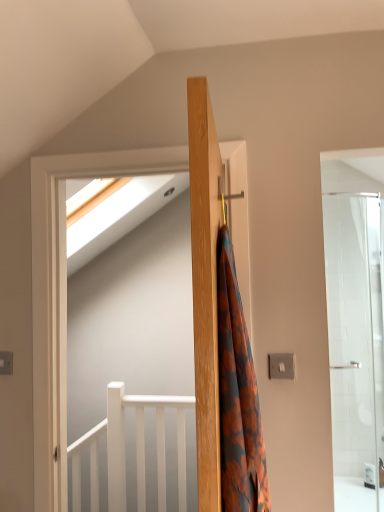
What do you see at coordinates (125, 452) in the screenshot? This screenshot has height=512, width=384. I see `white matte balustrade at lower left` at bounding box center [125, 452].

Describe the element at coordinates (220, 337) in the screenshot. I see `wooden coat hanger at center` at that location.

Image resolution: width=384 pixels, height=512 pixels. Find the location of `white glossy screen door at upper left`. white glossy screen door at upper left is located at coordinates (138, 357).

Image resolution: width=384 pixels, height=512 pixels. I want to click on orange floral fabric at center, so click(238, 396).

Does point (167, 401) come farther from viewer compared to point (211, 364)?

Yes, it is.

Between white glossy screen door at upper left and wooden coat hanger at center, which one appears on the right side from the viewer's perspective?

From the viewer's perspective, wooden coat hanger at center appears more on the right side.

Is there a large distance between white glossy screen door at upper left and wooden coat hanger at center?

That's right, there is a large distance between white glossy screen door at upper left and wooden coat hanger at center.

In the scene shown: Does white glossy screen door at upper left lie in front of wooden coat hanger at center?

That is False.

From a real-world perspective, does white matte balustrade at lower left sit lower than orange floral fabric at center?

Yes.

Considering the positions of objects white matte balustrade at lower left and orange floral fabric at center in the image provided, who is behind, white matte balustrade at lower left or orange floral fabric at center?

white matte balustrade at lower left is further from the camera.

Is white matte balustrade at lower left in contact with orange floral fabric at center?

No, white matte balustrade at lower left is not in contact with orange floral fabric at center.

Does point (117, 391) appear closer or farther from the camera than point (220, 340)?

Point (117, 391) appears to be farther away from the viewer than point (220, 340).

Is point (79, 461) behind point (116, 389)?

That is True.

Which is more to the left, white glossy screen door at upper left or white matte balustrade at lower left?

Positioned to the left is white matte balustrade at lower left.

Could you tell me if white glossy screen door at upper left is facing white matte balustrade at lower left?

No, white glossy screen door at upper left is not facing towards white matte balustrade at lower left.

From the picture: Which of these two, white matte balustrade at lower left or wooden coat hanger at center, is bigger?

With larger size is white matte balustrade at lower left.

Which object is wider, white matte balustrade at lower left or wooden coat hanger at center?

white matte balustrade at lower left is wider.

From the image's perspective, is white matte balustrade at lower left positioned above or below wooden coat hanger at center?

white matte balustrade at lower left is below wooden coat hanger at center.

How much distance is there between white matte balustrade at lower left and wooden coat hanger at center?

A distance of 1.77 meters exists between white matte balustrade at lower left and wooden coat hanger at center.

Are orange floral fabric at center and wooden coat hanger at center far apart?

orange floral fabric at center is actually quite close to wooden coat hanger at center.

How different are the orientations of orange floral fabric at center and wooden coat hanger at center in degrees?

There is a 177-degree angle between the facing directions of orange floral fabric at center and wooden coat hanger at center.

From a real-world perspective, who is located lower, orange floral fabric at center or wooden coat hanger at center?

In real-world perspective, orange floral fabric at center is lower.

Is wooden coat hanger at center at the back of orange floral fabric at center?

Yes, orange floral fabric at center's orientation is away from wooden coat hanger at center.

Which is closer, [212,344] or [222,391]?

The point [212,344] is closer.

Based on their sizes in the image, would you say wooden coat hanger at center is bigger or smaller than orange floral fabric at center?

wooden coat hanger at center is bigger than orange floral fabric at center.

Which object is further away from the camera, wooden coat hanger at center or orange floral fabric at center?

orange floral fabric at center is further from the camera.

Which of these two, wooden coat hanger at center or orange floral fabric at center, is wider?

Wider between the two is wooden coat hanger at center.

Is wooden coat hanger at center taller than white glossy screen door at upper left?

In fact, wooden coat hanger at center may be shorter than white glossy screen door at upper left.

From the image's perspective, is wooden coat hanger at center above or below white glossy screen door at upper left?

Clearly, from the image's perspective, wooden coat hanger at center is above white glossy screen door at upper left.

Find the location of a particular element. The width and height of the screenshot is (384, 512). door above the white glossy screen door at upper left (from a real-world perspective) is located at coordinates (220, 337).

Measure the distance between wooden coat hanger at center and white glossy screen door at upper left.

The distance of wooden coat hanger at center from white glossy screen door at upper left is 2.17 meters.

This screenshot has width=384, height=512. Identify the location of screen door on the left of wooden coat hanger at center. (138, 357).

Locate an element on the screen. shower curtain that is above the white matte balustrade at lower left (from a real-world perspective) is located at coordinates (238, 396).

Which object lies further to the anchor point orange floral fabric at center, white glossy screen door at upper left or wooden coat hanger at center?

white glossy screen door at upper left is positioned further to the anchor orange floral fabric at center.

Which object lies nearer to the anchor point white matte balustrade at lower left, orange floral fabric at center or wooden coat hanger at center?

The object closer to white matte balustrade at lower left is orange floral fabric at center.

Estimate the real-world distances between objects in this image. Which object is further from wooden coat hanger at center, white glossy screen door at upper left or orange floral fabric at center?

Based on the image, white glossy screen door at upper left appears to be further to wooden coat hanger at center.

From the image, which object appears to be farther from white matte balustrade at lower left, wooden coat hanger at center or white glossy screen door at upper left?

Among the two, wooden coat hanger at center is located further to white matte balustrade at lower left.

From the image, which object appears to be nearer to orange floral fabric at center, wooden coat hanger at center or white glossy screen door at upper left?

wooden coat hanger at center is closer to orange floral fabric at center.

Considering their positions, is white glossy screen door at upper left positioned closer to orange floral fabric at center than white matte balustrade at lower left?

white matte balustrade at lower left lies closer to orange floral fabric at center than the other object.

Estimate the real-world distances between objects in this image. Which object is closer to wooden coat hanger at center, white matte balustrade at lower left or orange floral fabric at center?

The object closer to wooden coat hanger at center is orange floral fabric at center.

Looking at this image, estimate the real-world distances between objects in this image. Which object is further from white matte balustrade at lower left, orange floral fabric at center or white glossy screen door at upper left?

orange floral fabric at center.

The height and width of the screenshot is (512, 384). I want to click on screen door located between wooden coat hanger at center and white matte balustrade at lower left in the depth direction, so click(138, 357).

Find the location of a particular element. The height and width of the screenshot is (512, 384). shower curtain between wooden coat hanger at center and white matte balustrade at lower left in the front-back direction is located at coordinates tap(238, 396).

Locate an element on the screen. screen door between orange floral fabric at center and white matte balustrade at lower left in the front-back direction is located at coordinates (138, 357).

At what (x,y) coordinates should I click in order to perform the action: click on shower curtain between wooden coat hanger at center and white glossy screen door at upper left along the z-axis. Please return your answer as a coordinate pair (x, y). The height and width of the screenshot is (512, 384). Looking at the image, I should click on (238, 396).